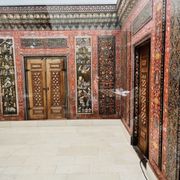
The image size is (180, 180). Identify the location of decorations above door. (45, 42), (141, 18).